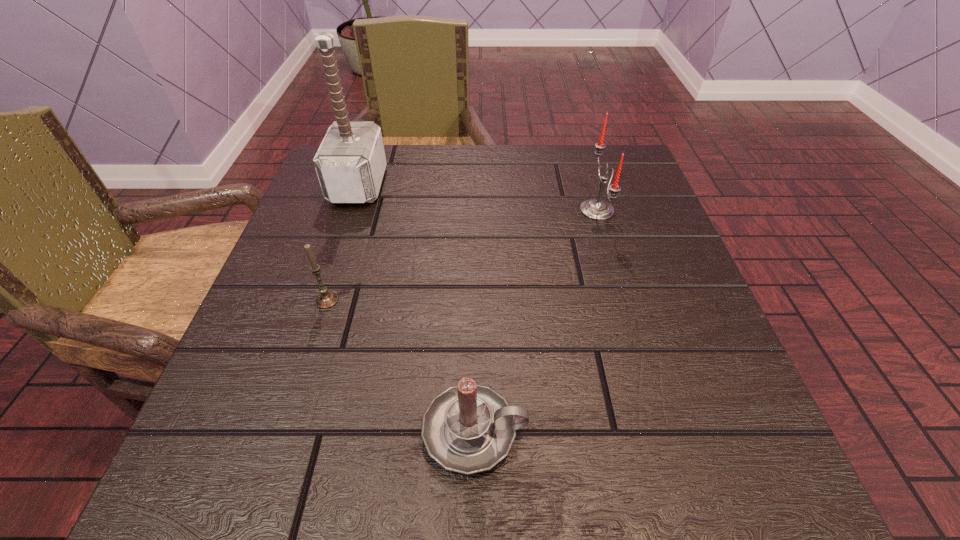
The height and width of the screenshot is (540, 960). I want to click on free space between the tallest object and the second nearest object, so click(x=343, y=242).

At what (x,y) coordinates should I click in order to perform the action: click on free point between the rightmost candle and the hammer. Please return your answer as a coordinate pair (x, y). This screenshot has width=960, height=540. Looking at the image, I should click on pyautogui.click(x=478, y=198).

Find the location of a particular element. free spot between the rightmost object and the nearest object is located at coordinates (536, 321).

Where is `unoccupied area between the second tallest object and the second candle from left to right`? This screenshot has width=960, height=540. unoccupied area between the second tallest object and the second candle from left to right is located at coordinates (536, 321).

Where is `vacant space that is in between the rightmost object and the nearest object`? This screenshot has height=540, width=960. vacant space that is in between the rightmost object and the nearest object is located at coordinates (536, 321).

You are a GUI agent. You are given a task and a screenshot of the screen. Output one action in this format:
    pyautogui.click(x=<x>, y=<y>)
    Task: Click on the unoccupied area between the second nearest candle and the tallest object
    Image resolution: width=960 pixels, height=540 pixels.
    Given the screenshot: What is the action you would take?
    pyautogui.click(x=343, y=242)

The height and width of the screenshot is (540, 960). What are the coordinates of `vacant area between the third farthest object and the tallest object` in the screenshot? It's located at (343, 242).

You are a GUI agent. You are given a task and a screenshot of the screen. Output one action in this format:
    pyautogui.click(x=<x>, y=<y>)
    Task: Click on the free spot between the tallest object and the second farthest candle
    
    Given the screenshot: What is the action you would take?
    pyautogui.click(x=343, y=242)

Identify the location of free space between the rightmost object and the hammer. Image resolution: width=960 pixels, height=540 pixels. (478, 198).

Locate an element on the screen. This screenshot has width=960, height=540. the third closest object to the second farthest candle is located at coordinates (596, 209).